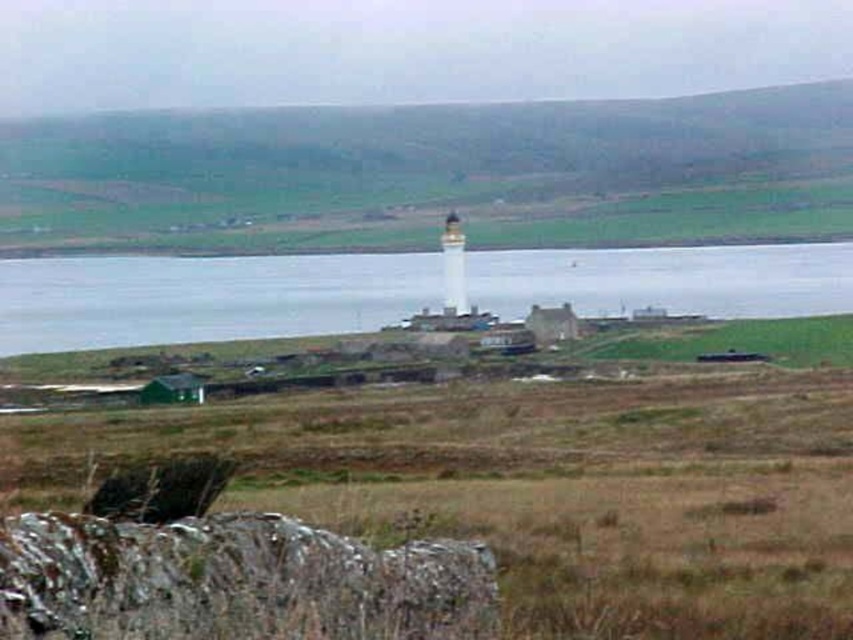
Question: Does rusty metallic stone at lower left have a smaller size compared to green grassy field at lower right?

Choices:
 (A) yes
 (B) no

Answer: (A)

Question: Observing the image, what is the correct spatial positioning of green grassy hillside at upper center in reference to clear water at center?

Choices:
 (A) below
 (B) above

Answer: (B)

Question: Which point appears farthest from the camera in this image?

Choices:
 (A) (74, 330)
 (B) (635, 352)
 (C) (195, 611)
 (D) (44, 128)

Answer: (D)

Question: Is green grassy hillside at upper center in front of green grassy field at lower right?

Choices:
 (A) no
 (B) yes

Answer: (A)

Question: Which of the following is the farthest from the observer?

Choices:
 (A) rusty metallic stone at lower left
 (B) clear water at center
 (C) green grassy field at lower right

Answer: (B)

Question: Which is farther from the green grassy hillside at upper center?

Choices:
 (A) rusty metallic stone at lower left
 (B) green grassy field at lower right

Answer: (A)